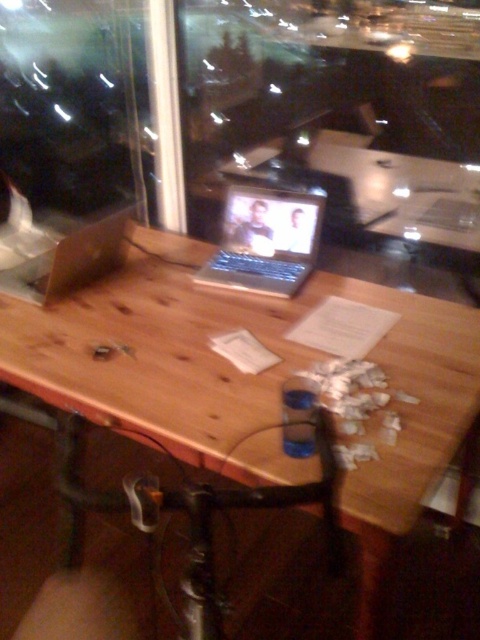
How far apart are silver metallic laptop at center and matte brown laptop at center?

The distance of silver metallic laptop at center from matte brown laptop at center is 16.69 inches.

Who is positioned more to the left, silver metallic laptop at center or matte brown laptop at center?

Positioned to the left is matte brown laptop at center.

Locate an element on the screen. This screenshot has height=640, width=480. silver metallic laptop at center is located at coordinates tap(264, 241).

I want to click on silver metallic laptop at center, so click(x=264, y=241).

Who is more forward, [136,236] or [120,236]?

Point [120,236] is in front.

Locate an element on the screen. This screenshot has width=480, height=640. wooden table at center is located at coordinates (250, 384).

This screenshot has width=480, height=640. I want to click on wooden table at center, so click(x=250, y=384).

Can you confirm if wooden table at center is bigger than silver metallic laptop at center?

A: Correct, wooden table at center is larger in size than silver metallic laptop at center.

You are a GUI agent. You are given a task and a screenshot of the screen. Output one action in this format:
    pyautogui.click(x=<x>, y=<y>)
    Task: Click on the wooden table at center
    
    Given the screenshot: What is the action you would take?
    pyautogui.click(x=250, y=384)

At what (x,y) coordinates should I click in order to perform the action: click on wooden table at center. Please return your answer as a coordinate pair (x, y). This screenshot has width=480, height=640. Looking at the image, I should click on (250, 384).